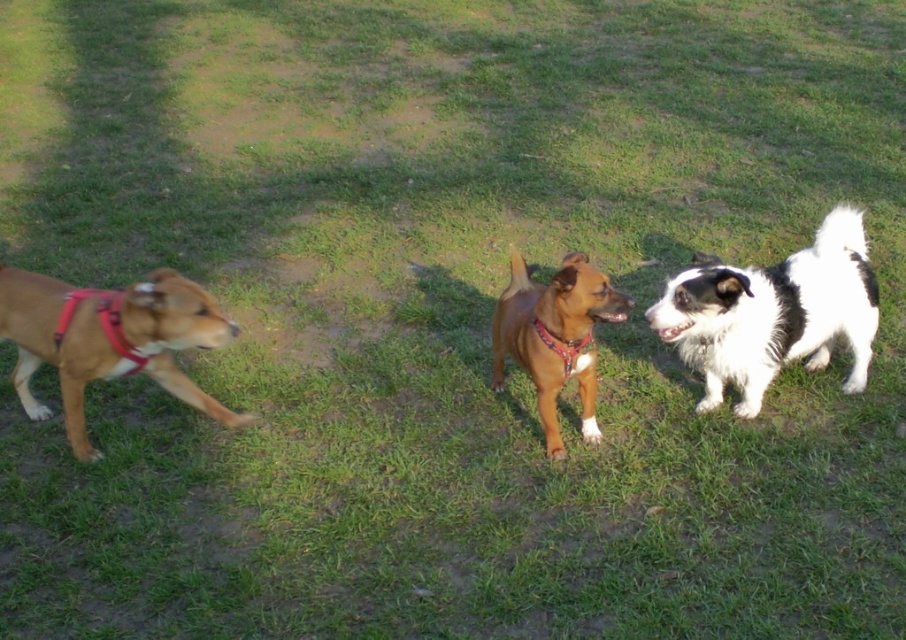
Question: Can you confirm if brown leather dog at center is positioned above matte red harness at left?

Choices:
 (A) yes
 (B) no

Answer: (B)

Question: Does brown leather dog at center have a lesser width compared to red fabric collar at center?

Choices:
 (A) no
 (B) yes

Answer: (A)

Question: In this image, where is brown leather dog at center located relative to red fabric collar at center?

Choices:
 (A) right
 (B) left

Answer: (B)

Question: Considering the real-world distances, which object is closest to the brown matte dog at left?

Choices:
 (A) black and white fur dog at right
 (B) brown leather dog at center
 (C) matte red harness at left

Answer: (C)

Question: Which point is farther from the camera taking this photo?

Choices:
 (A) (593, 394)
 (B) (74, 348)
 (C) (541, 330)
 (D) (807, 337)

Answer: (D)

Question: Among these objects, which one is nearest to the camera?

Choices:
 (A) red fabric collar at center
 (B) brown matte dog at left
 (C) matte red harness at left
 (D) black and white fur dog at right

Answer: (B)